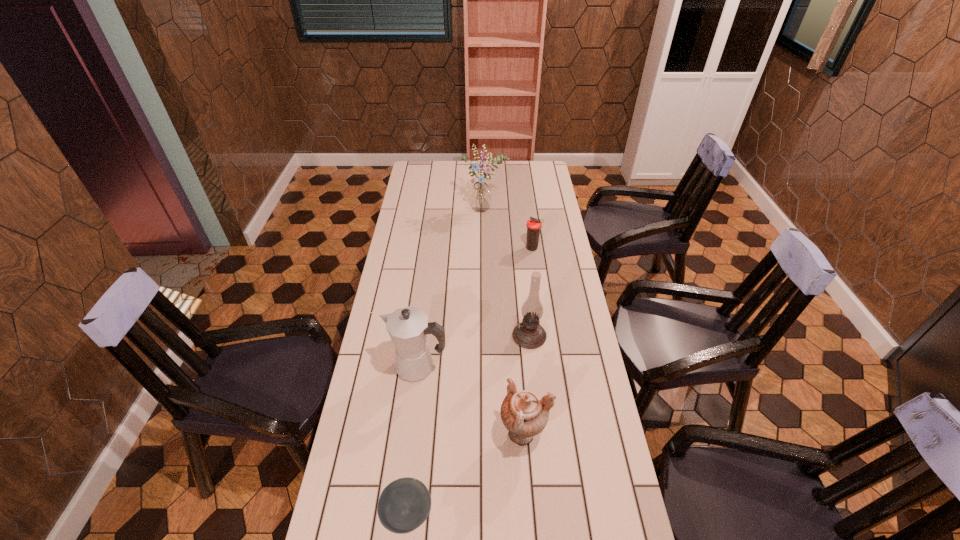
Where is `vacant space in between the thermos bottle and the coffeepot`? The width and height of the screenshot is (960, 540). vacant space in between the thermos bottle and the coffeepot is located at coordinates (475, 308).

You are a GUI agent. You are given a task and a screenshot of the screen. Output one action in this format:
    pyautogui.click(x=<x>, y=<y>)
    Task: Click on the vacant area that lies between the coffeepot and the third farthest object
    This screenshot has height=540, width=960.
    Given the screenshot: What is the action you would take?
    pyautogui.click(x=473, y=352)

You are a GUI agent. You are given a task and a screenshot of the screen. Output one action in this format:
    pyautogui.click(x=<x>, y=<y>)
    Task: Click on the vacant area between the fourth farthest object and the second nearest object
    
    Given the screenshot: What is the action you would take?
    pyautogui.click(x=471, y=401)

Where is `free space between the fourth tallest object and the coffeepot`? This screenshot has height=540, width=960. free space between the fourth tallest object and the coffeepot is located at coordinates (471, 401).

Where is `vacant area that lies between the bouquet and the fourth tallest object`? This screenshot has height=540, width=960. vacant area that lies between the bouquet and the fourth tallest object is located at coordinates [x=505, y=323].

Identify which object is the third closest to the urn. Please provide its 2D coordinates. Your answer should be formatted as a tuple, i.e. [(x, y)], where the tuple contains the x and y coordinates of a point satisfying the conditions above.

[(529, 333)]

Find the location of a particular element. The width and height of the screenshot is (960, 540). object that stands as the second closest to the third farthest object is located at coordinates (525, 414).

This screenshot has width=960, height=540. Find the location of `free region that satisfies the following two spatial constraints: 1. on the front side of the fourth farthest object; 2. on the right side of the third shortest object`. free region that satisfies the following two spatial constraints: 1. on the front side of the fourth farthest object; 2. on the right side of the third shortest object is located at coordinates (410, 435).

What are the coordinates of `vacant space that satisfies the following two spatial constraints: 1. on the back side of the second nearest object; 2. on the right side of the second farthest object` in the screenshot? It's located at (510, 248).

Identify the location of blank area in the image that satisfies the following two spatial constraints: 1. on the back side of the thermos bottle; 2. on the left side of the oil lamp. (520, 248).